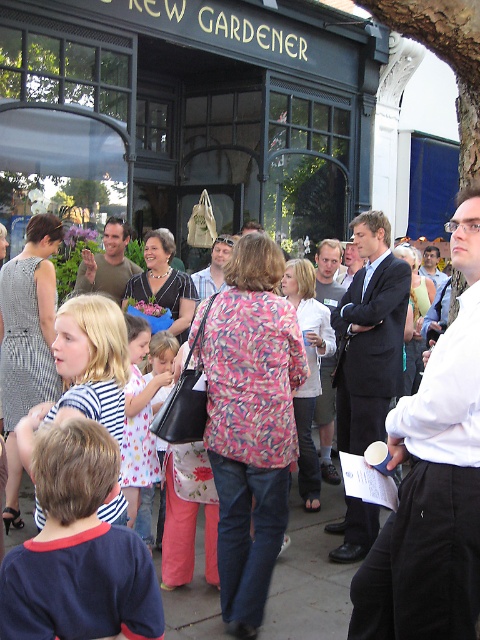
Question: Can you confirm if floral-patterned jacket at center is smaller than white dotted dress at center?

Choices:
 (A) yes
 (B) no

Answer: (B)

Question: Among these objects, which one is farthest from the camera?

Choices:
 (A) floral-patterned jacket at center
 (B) white dotted dress at center

Answer: (A)

Question: Does floral-patterned jacket at center come in front of white dotted dress at center?

Choices:
 (A) no
 (B) yes

Answer: (A)

Question: Which object is farther from the camera taking this photo?

Choices:
 (A) floral-patterned jacket at center
 (B) white dotted dress at center

Answer: (A)

Question: Is floral-patterned jacket at center below white dotted dress at center?

Choices:
 (A) no
 (B) yes

Answer: (B)